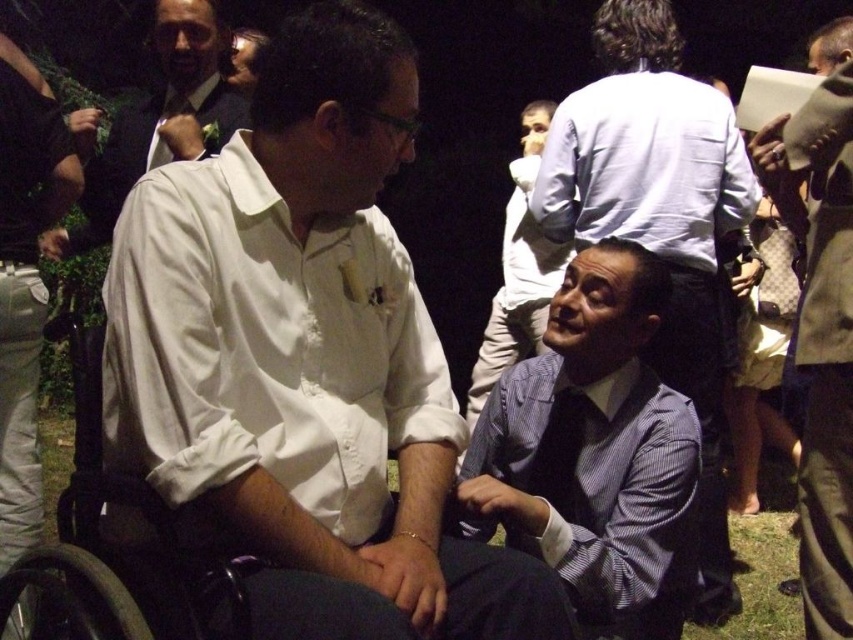
Measure the distance from striped fabric shirt at lower center to black plastic wheelchair at left.

88.25 centimeters

Can you confirm if striped fabric shirt at lower center is positioned to the left of black plastic wheelchair at left?

No, striped fabric shirt at lower center is not to the left of black plastic wheelchair at left.

Who is more distant from viewer, (x=544, y=339) or (x=160, y=538)?

Positioned behind is point (x=544, y=339).

The image size is (853, 640). I want to click on striped fabric shirt at lower center, so click(x=595, y=451).

Is point (828, 132) more distant than point (509, 273)?

No, it is not.

Who is positioned more to the left, light brown leather jacket at upper right or light blue striped shirt at center?

light blue striped shirt at center

What do you see at coordinates (821, 320) in the screenshot? I see `light brown leather jacket at upper right` at bounding box center [821, 320].

At what (x,y) coordinates should I click in order to perform the action: click on light brown leather jacket at upper right. Please return your answer as a coordinate pair (x, y). The width and height of the screenshot is (853, 640). Looking at the image, I should click on [x=821, y=320].

Between white matte shirt at center and white satin tie at upper left, which one appears on the right side from the viewer's perspective?

From the viewer's perspective, white matte shirt at center appears more on the right side.

Does white matte shirt at center have a smaller size compared to white satin tie at upper left?

No.

Describe the element at coordinates (305, 360) in the screenshot. I see `white matte shirt at center` at that location.

The image size is (853, 640). I want to click on white matte shirt at center, so click(x=305, y=360).